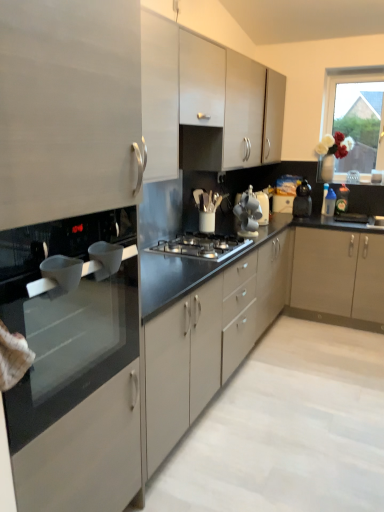
Where is `stainless steel gas stove at center`? This screenshot has height=512, width=384. stainless steel gas stove at center is located at coordinates (202, 246).

Locate an element on the screen. The image size is (384, 512). black plastic kettle at right is located at coordinates (303, 200).

Locate an element on the screen. This screenshot has height=512, width=384. white ceramic cups at center, the 2th appliance positioned from the front is located at coordinates (248, 214).

Based on the photo, from a real-world perspective, between black glass stove at left, the second countertop from the back, and black plastic kettle at right, who is vertically lower?

In real-world perspective, black glass stove at left, the second countertop from the back, is lower.

Is black glass stove at left, the second countertop from the back, positioned with its back to black plastic kettle at right?

black glass stove at left, the second countertop from the back, is not turned away from black plastic kettle at right.

Is black glass stove at left, the first countertop when ordered from front to back, at the left side of black plastic kettle at right?

Yes.

Considering the relative sizes of black glass stove at left, the first countertop when ordered from front to back, and black plastic kettle at right in the image provided, is black glass stove at left, the first countertop when ordered from front to back, smaller than black plastic kettle at right?

No.

Considering the points (371, 128) and (310, 191), which point is behind, point (371, 128) or point (310, 191)?

Positioned behind is point (371, 128).

Which of these two, white glass vase at upper right or black plastic kettle at right, is bigger?

With larger size is white glass vase at upper right.

Can you confirm if white glass vase at upper right is wider than black plastic kettle at right?

Incorrect, the width of white glass vase at upper right does not surpass that of black plastic kettle at right.

Looking at this image, who is bigger, black glass stove at left, the second countertop from the back, or white glass vase at upper right?

black glass stove at left, the second countertop from the back, is bigger.

Is black glass stove at left, the first countertop when ordered from front to back, facing away from white glass vase at upper right?

No.

Would you say black glass stove at left, the second countertop from the back, is inside or outside white glass vase at upper right?

black glass stove at left, the second countertop from the back, is not enclosed by white glass vase at upper right.

Considering the positions of objects black plastic kettle at right and stainless steel gas stove at center in the image provided, who is more to the left, black plastic kettle at right or stainless steel gas stove at center?

Positioned to the left is stainless steel gas stove at center.

Considering the sizes of objects black plastic kettle at right and stainless steel gas stove at center in the image provided, who is taller, black plastic kettle at right or stainless steel gas stove at center?

Standing taller between the two is black plastic kettle at right.

Is point (304, 182) positioned behind point (174, 244)?

Yes.

Is black plastic kettle at right next to stainless steel gas stove at center and touching it?

black plastic kettle at right and stainless steel gas stove at center are clearly separated.

Identify the location of countertop located above the stainless steel gas stove at center (from a real-world perspective). (67, 319).

From the image's perspective, is black glass stove at left, the second countertop from the back, below stainless steel gas stove at center?

Yes, from the image's perspective, black glass stove at left, the second countertop from the back, is beneath stainless steel gas stove at center.

Does black glass stove at left, the first countertop when ordered from front to back, contain stainless steel gas stove at center?

No, stainless steel gas stove at center is located outside of black glass stove at left, the first countertop when ordered from front to back.

Consider the image. Is black matte countertop at center, which ranks as the first countertop in back-to-front order, thinner than black plastic kettle at right?

In fact, black matte countertop at center, which ranks as the first countertop in back-to-front order, might be wider than black plastic kettle at right.

Based on their positions, is black matte countertop at center, which ranks as the 2th countertop in front-to-back order, located to the left or right of black plastic kettle at right?

black matte countertop at center, which ranks as the 2th countertop in front-to-back order, is positioned on black plastic kettle at right's left side.

Is black matte countertop at center, which ranks as the first countertop in back-to-front order, positioned with its back to black plastic kettle at right?

No, black matte countertop at center, which ranks as the first countertop in back-to-front order, is not facing away from black plastic kettle at right.

Consider the image. Is stainless steel gas stove at center surrounded by white glass vase at upper right?

No.

Considering the sizes of objects white glass vase at upper right and stainless steel gas stove at center in the image provided, who is smaller, white glass vase at upper right or stainless steel gas stove at center?

Smaller between the two is stainless steel gas stove at center.

Which object is positioned more to the right, white glass vase at upper right or stainless steel gas stove at center?

white glass vase at upper right is more to the right.

Find the location of a particular element. Image resolution: width=384 pixels, height=512 pixels. the 2nd countertop counting from the left of the black plastic kettle at right is located at coordinates (67, 319).

This screenshot has height=512, width=384. I want to click on kitchen appliance below the white glass vase at upper right (from the image's perspective), so click(303, 200).

Based on their spatial positions, is stainless steel gas stove at center or matte white cabinet at upper center closer to white glossy cup at left, arranged as the third appliance when viewed from the back?

stainless steel gas stove at center is positioned closer to the anchor white glossy cup at left, arranged as the third appliance when viewed from the back.

Looking at the image, which one is located further to white ceramic cups at center, marked as the second appliance in a right-to-left arrangement, black glass stove at left, the second countertop from the back, or white glossy cup at left, the first appliance in the left-to-right sequence?

black glass stove at left, the second countertop from the back, is positioned further to the anchor white ceramic cups at center, marked as the second appliance in a right-to-left arrangement.

Looking at the image, which one is located further to black plastic kettle at right, metallic silver toaster at center, the third appliance in the front-to-back sequence, or black glass stove at left, the second countertop from the back?

Based on the image, black glass stove at left, the second countertop from the back, appears to be further to black plastic kettle at right.

Considering their positions, is black plastic kettle at right positioned further to white ceramic cups at center, placed as the 2th appliance when sorted from left to right, than black matte countertop at center, which ranks as the 2th countertop in front-to-back order?

The object further to white ceramic cups at center, placed as the 2th appliance when sorted from left to right, is black plastic kettle at right.

Estimate the real-world distances between objects in this image. Which object is further from matte white cabinet at upper center, black matte countertop at center, which ranks as the first countertop in back-to-front order, or white glass vase at upper right?

white glass vase at upper right.

Based on their spatial positions, is black plastic kettle at right or white glass vase at upper right further from white glossy cup at left, placed as the 1th appliance when sorted from front to back?

white glass vase at upper right.

Estimate the real-world distances between objects in this image. Which object is closer to stainless steel gas stove at center, white ceramic cups at center, marked as the second appliance in a right-to-left arrangement, or white glass vase at upper right?

white ceramic cups at center, marked as the second appliance in a right-to-left arrangement, is positioned closer to the anchor stainless steel gas stove at center.

Which object lies nearer to the anchor point white glossy cup at left, placed as the 1th appliance when sorted from front to back, white ceramic cups at center, placed as the 2th appliance when sorted from left to right, or white glass vase at upper right?

The object closer to white glossy cup at left, placed as the 1th appliance when sorted from front to back, is white ceramic cups at center, placed as the 2th appliance when sorted from left to right.

Locate an element on the screen. This screenshot has height=512, width=384. countertop located between white glossy cup at left, the first appliance in the left-to-right sequence, and white ceramic cups at center, placed as the 2th appliance when sorted from left to right, in the depth direction is located at coordinates (250, 318).

Locate an element on the screen. gas stove located between black matte countertop at center, which ranks as the first countertop in back-to-front order, and black plastic kettle at right in the depth direction is located at coordinates (202, 246).

Identify the location of countertop located between black glass stove at left, the first countertop when ordered from front to back, and stainless steel gas stove at center in the depth direction. (250, 318).

At what (x,y) coordinates should I click in order to perform the action: click on gas stove located between black glass stove at left, the second countertop from the back, and white glass vase at upper right in the depth direction. Please return your answer as a coordinate pair (x, y). Looking at the image, I should click on (202, 246).